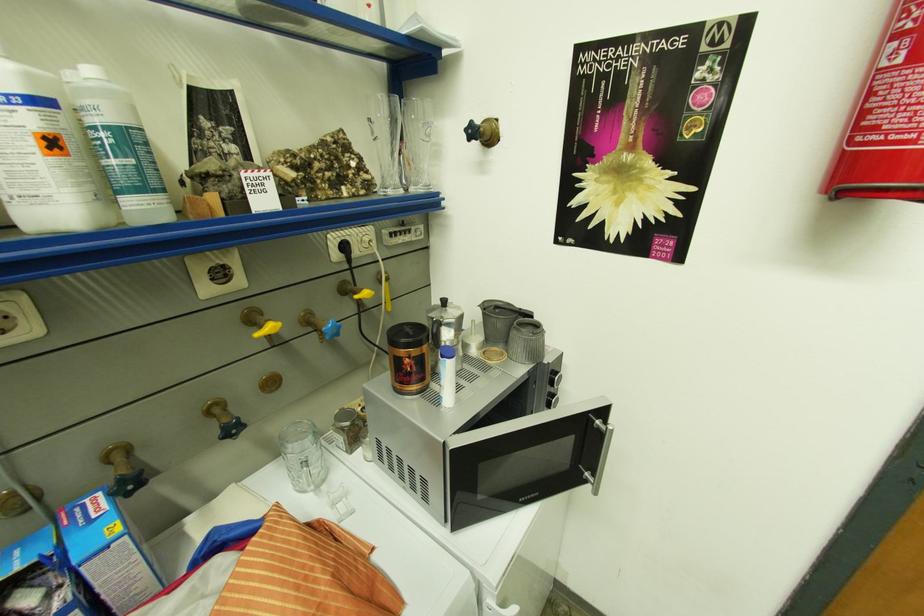
The height and width of the screenshot is (616, 924). What do you see at coordinates (260, 323) in the screenshot?
I see `the yellow lever handle` at bounding box center [260, 323].